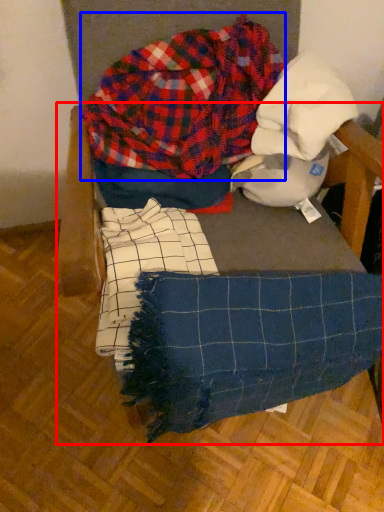
Question: Which of the following is the farthest to the observer, furniture (highlighted by a red box) or flannel (highlighted by a blue box)?

Choices:
 (A) furniture
 (B) flannel

Answer: (B)